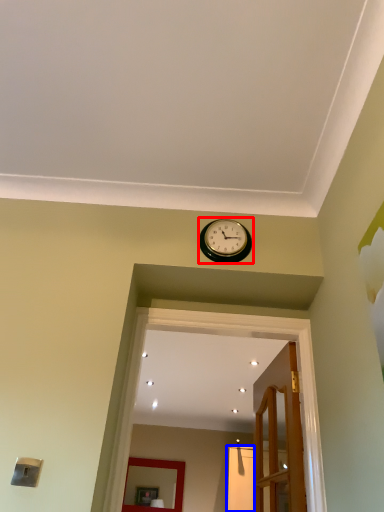
Question: Which object is further to the camera taking this photo, wall clock (highlighted by a red box) or glass door (highlighted by a blue box)?

Choices:
 (A) wall clock
 (B) glass door

Answer: (B)